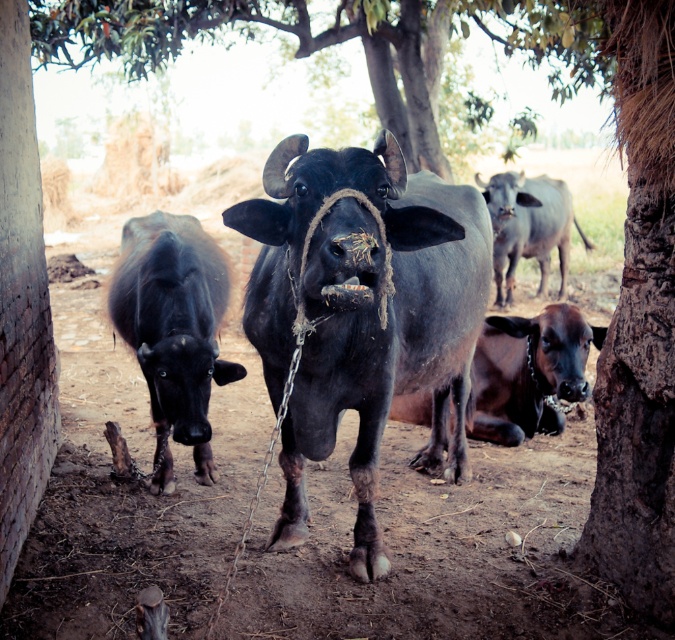
Is point (477, 289) closer to viewer compared to point (497, 301)?

Yes, point (477, 289) is in front of point (497, 301).

Does shiny black yak at center appear on the left side of smooth gray bull at upper right?

Correct, you'll find shiny black yak at center to the left of smooth gray bull at upper right.

Which is behind, point (362, 154) or point (500, 250)?

Point (500, 250)

I want to click on shiny black yak at center, so click(x=362, y=312).

Does shiny black yak at center have a lesser width compared to brown matte cow at lower right?

In fact, shiny black yak at center might be wider than brown matte cow at lower right.

Can you confirm if shiny black yak at center is smaller than brown matte cow at lower right?

No.

At what (x,y) coordinates should I click in order to perform the action: click on shiny black yak at center. Please return your answer as a coordinate pair (x, y). Image resolution: width=675 pixels, height=640 pixels. Looking at the image, I should click on (362, 312).

The width and height of the screenshot is (675, 640). What are the coordinates of `shiny black yak at center` in the screenshot? It's located at (362, 312).

Is green leafy tree at upper center smaller than brown matte cow at lower right?

Indeed, green leafy tree at upper center has a smaller size compared to brown matte cow at lower right.

Does point (437, 140) come farther from viewer compared to point (594, 326)?

Yes.

What do you see at coordinates (338, 42) in the screenshot? I see `green leafy tree at upper center` at bounding box center [338, 42].

The image size is (675, 640). What are the coordinates of `green leafy tree at upper center` in the screenshot? It's located at (338, 42).